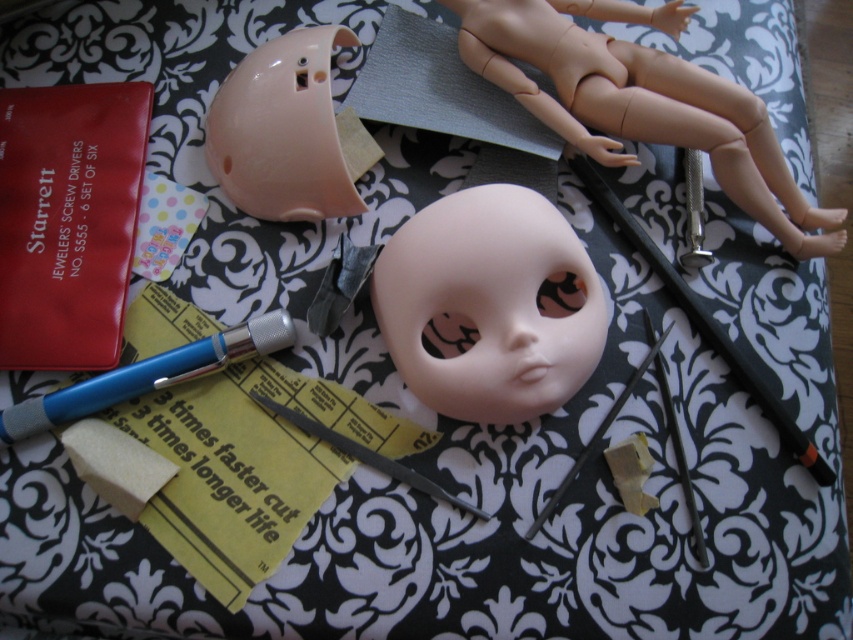
Question: Which point is closer to the camera?

Choices:
 (A) (64, 388)
 (B) (282, 74)
 (C) (540, 280)
 (D) (769, 166)

Answer: (C)

Question: Which point is farther to the camera?

Choices:
 (A) smooth beige doll at upper right
 (B) matte plastic helmet at upper center

Answer: (A)

Question: Is smooth beige doll at upper right to the right of matte plastic helmet at upper center from the viewer's perspective?

Choices:
 (A) no
 (B) yes

Answer: (B)

Question: Can you confirm if matte plastic doll head at center is smaller than matte plastic helmet at upper center?

Choices:
 (A) no
 (B) yes

Answer: (A)

Question: Which point is closer to the camera?

Choices:
 (A) (51, 396)
 (B) (572, 124)
 (C) (444, 268)
 (D) (329, 104)

Answer: (C)

Question: Does matte plastic doll head at center appear on the right side of matte plastic helmet at upper center?

Choices:
 (A) yes
 (B) no

Answer: (A)